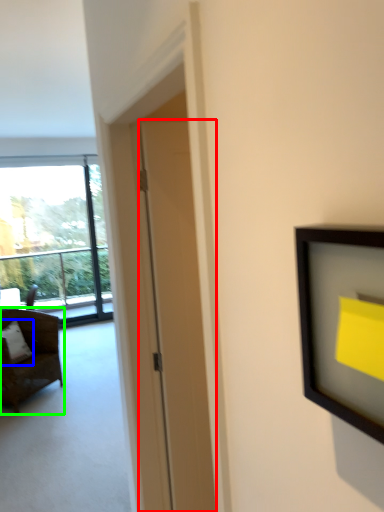
Question: Based on their relative distances, which object is farther from door (highlighted by a red box)? Choose from pillow (highlighted by a blue box) and chair (highlighted by a green box).

Choices:
 (A) pillow
 (B) chair

Answer: (A)